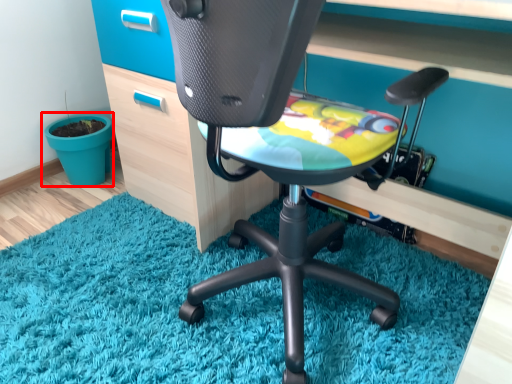
Question: From the image's perspective, where is flowerpot (annotated by the red box) located relative to chair?

Choices:
 (A) above
 (B) below

Answer: (A)